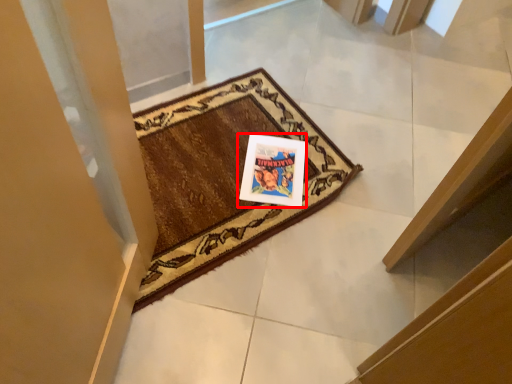
Question: Where is picture frame (annotated by the red box) located in relation to mat in the image?

Choices:
 (A) right
 (B) left

Answer: (A)